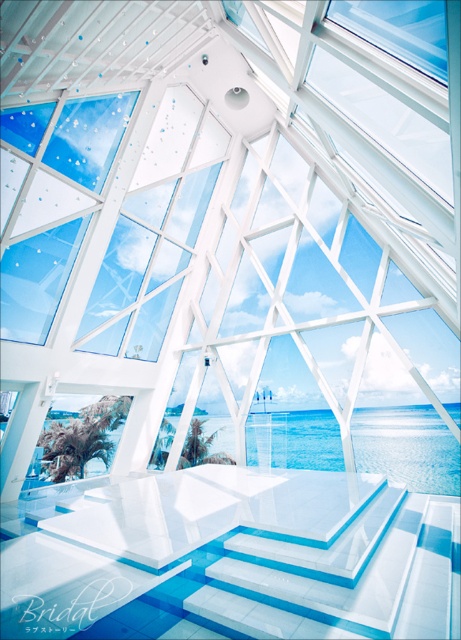
Question: Does transparent glass water at center have a smaller size compared to transparent glass window at upper center?

Choices:
 (A) yes
 (B) no

Answer: (B)

Question: Is transparent glass water at center below transparent glass window at upper center?

Choices:
 (A) yes
 (B) no

Answer: (A)

Question: Among these objects, which one is nearest to the camera?

Choices:
 (A) transparent glass water at center
 (B) transparent glass window at upper center

Answer: (B)

Question: Is transparent glass water at center positioned before transparent glass window at upper center?

Choices:
 (A) yes
 (B) no

Answer: (B)

Question: Among these objects, which one is farthest from the camera?

Choices:
 (A) transparent glass window at upper center
 (B) transparent glass water at center

Answer: (B)